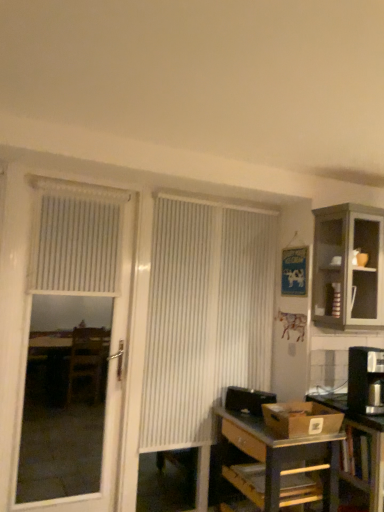
Question: Is metallic silver table at lower right thinner than white vertical blinds at center?

Choices:
 (A) no
 (B) yes

Answer: (A)

Question: Can you confirm if metallic silver table at lower right is positioned to the left of white vertical blinds at center?

Choices:
 (A) no
 (B) yes

Answer: (A)

Question: Can you confirm if metallic silver table at lower right is taller than white vertical blinds at center?

Choices:
 (A) no
 (B) yes

Answer: (A)

Question: Is metallic silver table at lower right not inside white vertical blinds at center?

Choices:
 (A) yes
 (B) no

Answer: (A)

Question: Is metallic silver table at lower right positioned behind white vertical blinds at center?

Choices:
 (A) no
 (B) yes

Answer: (A)

Question: Is black plastic coffee maker at right to the left or to the right of metallic gray desk at lower right in the image?

Choices:
 (A) left
 (B) right

Answer: (B)

Question: Is point (365, 373) closer or farther from the camera than point (228, 426)?

Choices:
 (A) closer
 (B) farther

Answer: (A)

Question: From a real-world perspective, is black plastic coffee maker at right positioned above or below metallic gray desk at lower right?

Choices:
 (A) above
 (B) below

Answer: (A)

Question: Considering the positions of black plastic coffee maker at right and metallic gray desk at lower right in the image, is black plastic coffee maker at right wider or thinner than metallic gray desk at lower right?

Choices:
 (A) thin
 (B) wide

Answer: (A)

Question: Does point (157, 285) appear closer or farther from the camera than point (370, 450)?

Choices:
 (A) closer
 (B) farther

Answer: (B)

Question: In terms of height, does white vertical blinds at center look taller or shorter compared to metallic silver table at lower right?

Choices:
 (A) short
 (B) tall

Answer: (B)

Question: From a real-world perspective, is white vertical blinds at center positioned above or below metallic silver table at lower right?

Choices:
 (A) below
 (B) above

Answer: (B)

Question: Considering the positions of white vertical blinds at center and metallic silver table at lower right in the image, is white vertical blinds at center bigger or smaller than metallic silver table at lower right?

Choices:
 (A) small
 (B) big

Answer: (A)

Question: Looking at the image, does white textured blind at upper left seem bigger or smaller compared to metallic silver table at lower right?

Choices:
 (A) big
 (B) small

Answer: (B)

Question: Is white textured blind at upper left situated inside metallic silver table at lower right or outside?

Choices:
 (A) outside
 (B) inside

Answer: (A)